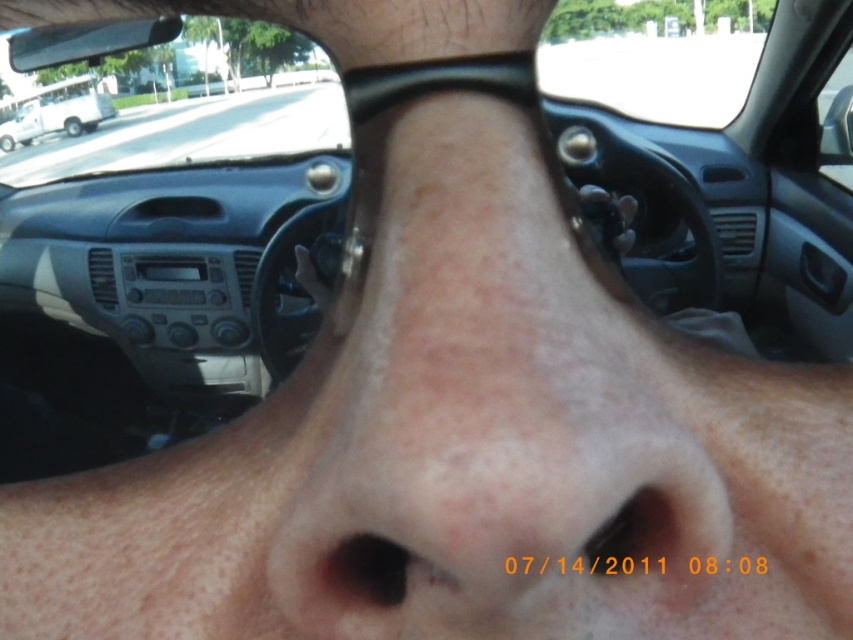
You are sitting in the car and want to see the white matte van at upper left through the transparent glass car window at upper center. Is the van visible through the window?

The transparent glass car window at upper center is closer to the viewer than the white matte van at upper left, so yes, the van is visible through the window.

You are a passenger in the car. You want to look at the street view through the transparent glass car window at upper center and the white matte van at upper left. Which object should you look to your left to see?

The transparent glass car window at upper center is to the left of the white matte van at upper left, so you should look to your left to see the transparent glass car window at upper center.